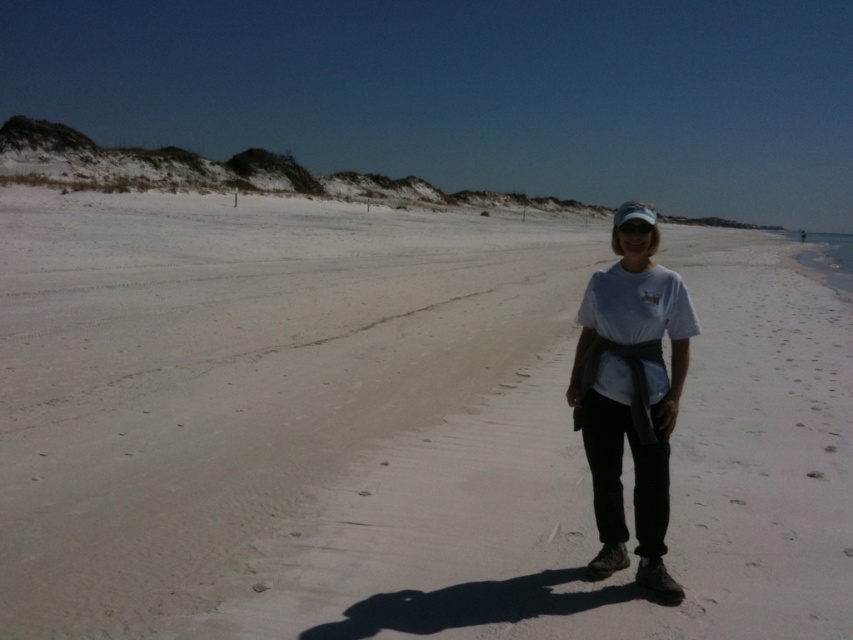
Question: Does white sand at center appear on the left side of white cotton shirt at center?

Choices:
 (A) no
 (B) yes

Answer: (A)

Question: Among these points, which one is farthest from the camera?

Choices:
 (A) (654, 211)
 (B) (674, 326)

Answer: (B)

Question: Is white cotton shirt at center further to camera compared to white fabric baseball hat at center?

Choices:
 (A) no
 (B) yes

Answer: (A)

Question: Estimate the real-world distances between objects in this image. Which object is closer to the white sand at center?

Choices:
 (A) white fabric baseball hat at center
 (B) white cotton shirt at center

Answer: (A)

Question: Which point is closer to the camera?

Choices:
 (A) white cotton shirt at center
 (B) white fabric baseball hat at center

Answer: (A)

Question: Does white cotton shirt at center lie behind white fabric baseball hat at center?

Choices:
 (A) no
 (B) yes

Answer: (A)